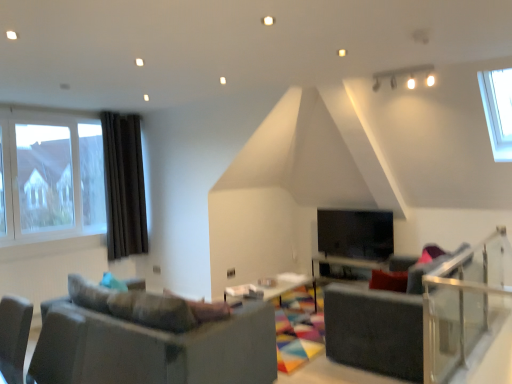
Question: Is dark brown fabric curtain at left oriented towards clear glass window at left?

Choices:
 (A) no
 (B) yes

Answer: (A)

Question: Can you confirm if dark brown fabric curtain at left is bigger than clear glass window at left?

Choices:
 (A) no
 (B) yes

Answer: (A)

Question: Is dark brown fabric curtain at left far from clear glass window at left?

Choices:
 (A) no
 (B) yes

Answer: (A)

Question: Does dark brown fabric curtain at left have a greater height compared to clear glass window at left?

Choices:
 (A) no
 (B) yes

Answer: (B)

Question: Is dark brown fabric curtain at left to the right of clear glass window at left from the viewer's perspective?

Choices:
 (A) yes
 (B) no

Answer: (A)

Question: Can you confirm if dark brown fabric curtain at left is smaller than clear glass window at left?

Choices:
 (A) yes
 (B) no

Answer: (A)

Question: Considering the relative sizes of matte gray couch at lower left and wooden table at center, acting as the first table starting from the right, in the image provided, is matte gray couch at lower left bigger than wooden table at center, acting as the first table starting from the right,?

Choices:
 (A) yes
 (B) no

Answer: (A)

Question: Does matte gray couch at lower left come behind wooden table at center, acting as the 2th table starting from the front?

Choices:
 (A) yes
 (B) no

Answer: (B)

Question: Is matte gray couch at lower left closer to the viewer compared to wooden table at center, the first table from the back?

Choices:
 (A) no
 (B) yes

Answer: (B)

Question: Does matte gray couch at lower left have a greater width compared to wooden table at center, the first table from the back?

Choices:
 (A) no
 (B) yes

Answer: (B)

Question: From the image's perspective, does matte gray couch at lower left appear higher than wooden table at center, the second table in the left-to-right sequence?

Choices:
 (A) no
 (B) yes

Answer: (B)

Question: Is matte gray couch at lower left next to wooden table at center, the second table in the left-to-right sequence, and touching it?

Choices:
 (A) yes
 (B) no

Answer: (B)

Question: Considering the relative sizes of wooden table at center, the first table from the back, and clear glass balustrade at right in the image provided, is wooden table at center, the first table from the back, wider than clear glass balustrade at right?

Choices:
 (A) yes
 (B) no

Answer: (A)